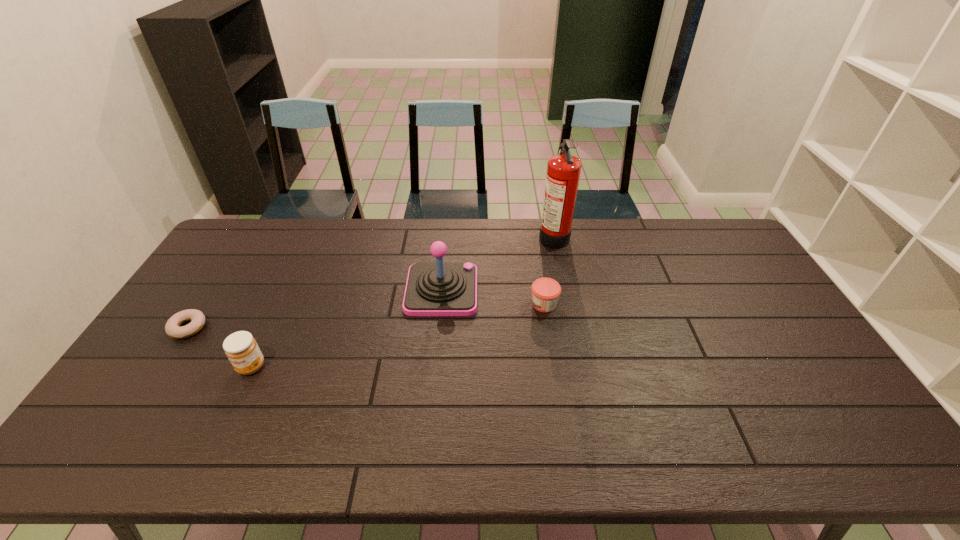
Where is `object present at the left edge`? The image size is (960, 540). object present at the left edge is located at coordinates (172, 328).

Find the location of a particular element. free space at the far edge of the desktop is located at coordinates (288, 231).

The height and width of the screenshot is (540, 960). In order to click on vacant space at the near edge of the desktop in this screenshot , I will do `click(748, 458)`.

You are a GUI agent. You are given a task and a screenshot of the screen. Output one action in this format:
    pyautogui.click(x=<x>, y=<y>)
    Task: Click on the free space at the left edge of the desktop
    This screenshot has height=540, width=960.
    Given the screenshot: What is the action you would take?
    pyautogui.click(x=183, y=303)

Image resolution: width=960 pixels, height=540 pixels. Identify the location of blank area at the right edge. (x=729, y=273).

Where is `blank region between the farther jam and the doughnut`? The width and height of the screenshot is (960, 540). blank region between the farther jam and the doughnut is located at coordinates (366, 316).

Identify the location of free space between the third object from left to right and the farthest object. The width and height of the screenshot is (960, 540). (497, 263).

What are the coordinates of `vacant area between the third tallest object and the doughnut` in the screenshot? It's located at (220, 347).

Find the location of a particular element. Image resolution: width=960 pixels, height=540 pixels. vacant space that is in between the left jam and the shortest object is located at coordinates (220, 347).

Where is `unoccupied area between the fourth object from right to left and the fourth shortest object`? This screenshot has height=540, width=960. unoccupied area between the fourth object from right to left and the fourth shortest object is located at coordinates (347, 328).